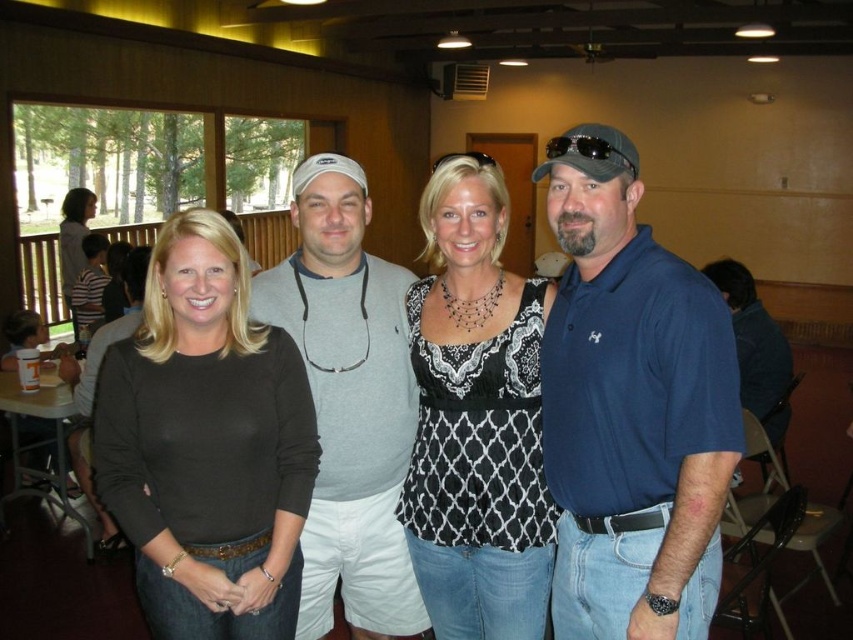
You are a photographer adjusting the lighting for a group photo. You need to ensure that the blue cotton polo shirt at right and the black lace top at center are both well lit. Given their thickness, which clothing item might require more focused lighting to avoid shadows?

The black lace top at center is thicker than the blue cotton polo shirt at right, so it might cast deeper shadows and require more focused lighting.

You are a photographer at the event and need to ensure that both the black lace top at center and the gray cotton sweater at center are visible in the photo. Given their sizes, which one might you need to adjust the camera angle to better highlight?

The black lace top at center is smaller than the gray cotton sweater at center, so you might need to adjust the camera angle to better highlight the smaller black lace top at center to ensure it is clearly visible.